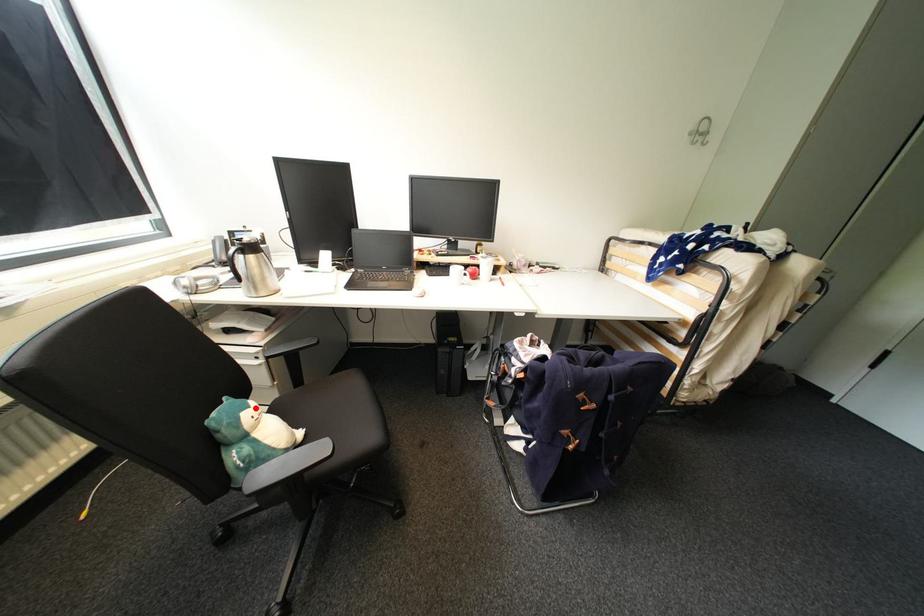
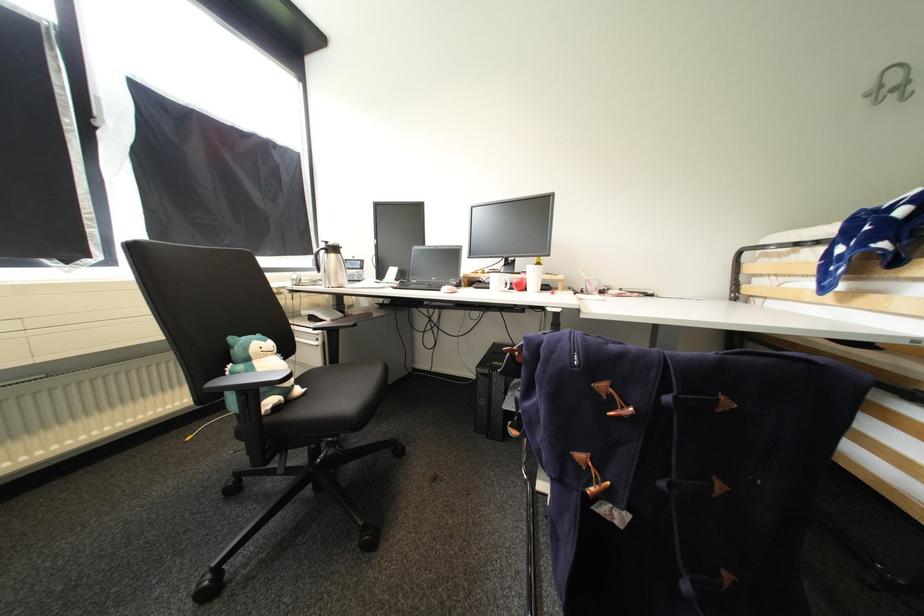
The point at the highlighted location is marked in the first image. Where is the corresponding point in the second image?

(272, 342)